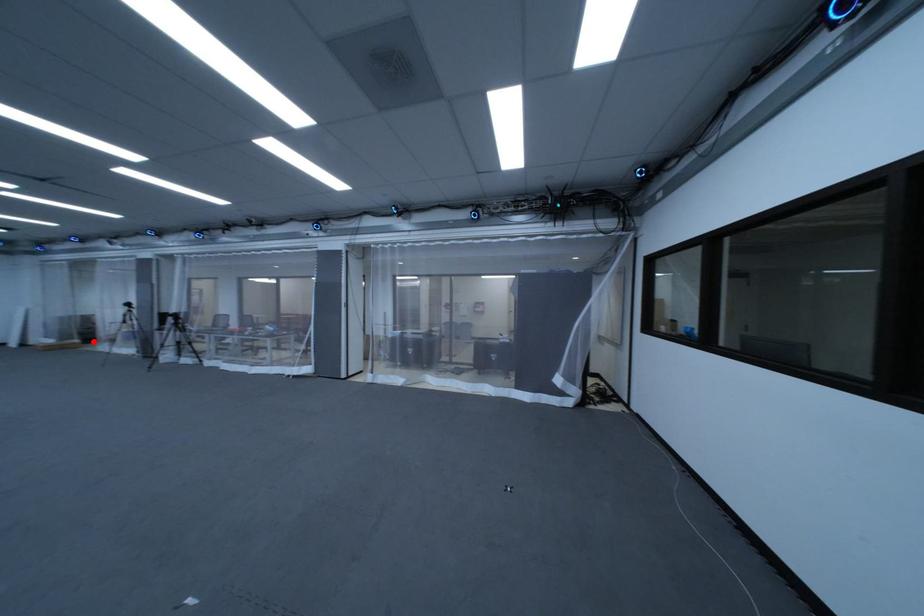
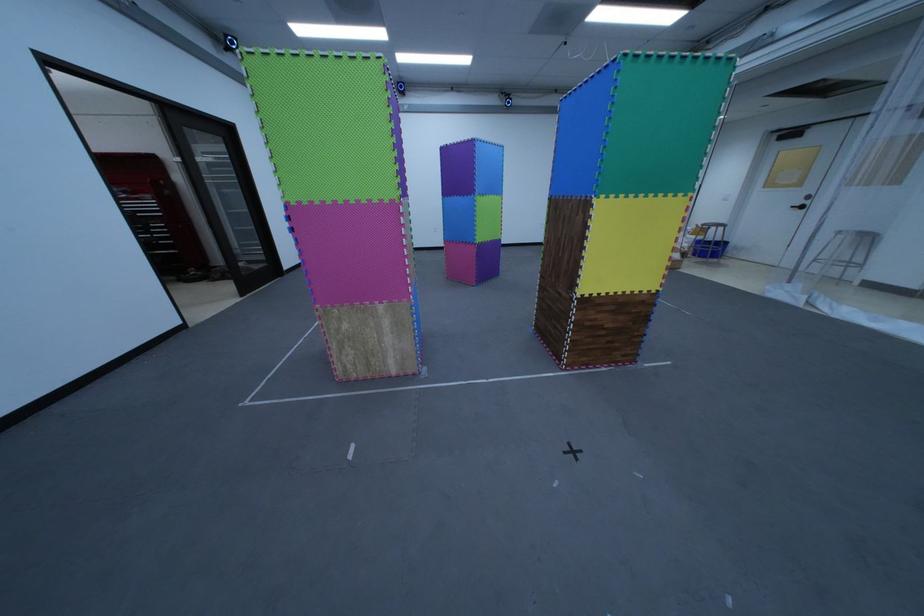
Question: I am providing you with two images of the same scene from different viewpoints. In image1, a red point is highlighted. Considering the same 3D point in image2, which of the following is correct?

Choices:
 (A) It is closer
 (B) It is farther

Answer: (B)